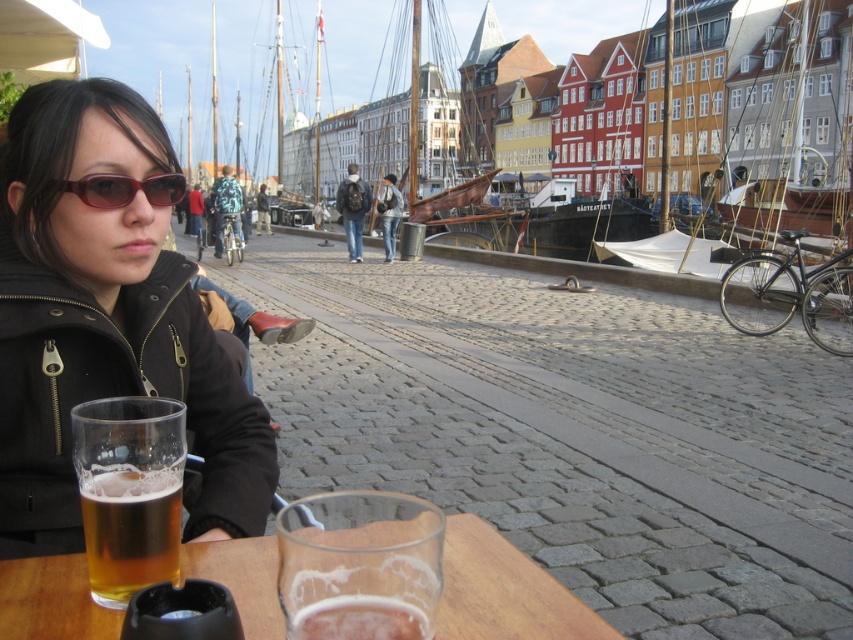
You are standing at the waterfront and want to reach a specific location marked by point (x=492, y=566). If you can walk 3 feet per second, how many seconds will it take you to reach that point?

The distance between you and point (x=492, y=566) is 8.92 feet. At a walking speed of 3 feet per second, it would take approximately 2.97 seconds to reach the point.

Please provide the 2D coordinates of the clear glass table at center in the image. The coordinates should be in the format of a tuple with two decimal numbers separated by a comma, enclosed in parentheses. The first number represents the x coordinate and the second the y coordinate. The coordinate system is normalized such that the bottom left corner of the image is at position 0,0 and the top right corner is at position 1,1. The coordinates are given to three decimal places.

The 2D coordinates of the clear glass table at center are at point (503,592).